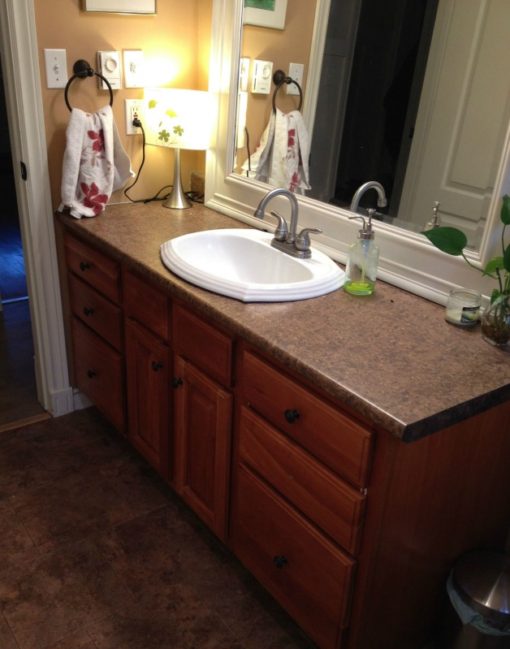
The width and height of the screenshot is (510, 649). I want to click on candle, so click(x=458, y=311).